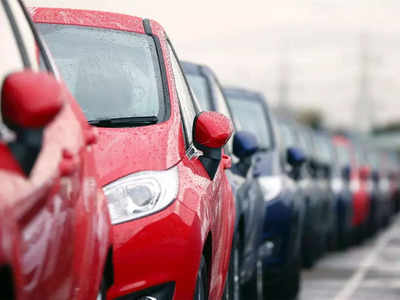
Locate an element on the screen. The height and width of the screenshot is (300, 400). mirror is located at coordinates (38, 95), (212, 133), (245, 147), (295, 152), (314, 166), (328, 166), (347, 166), (365, 170), (378, 171), (397, 170).